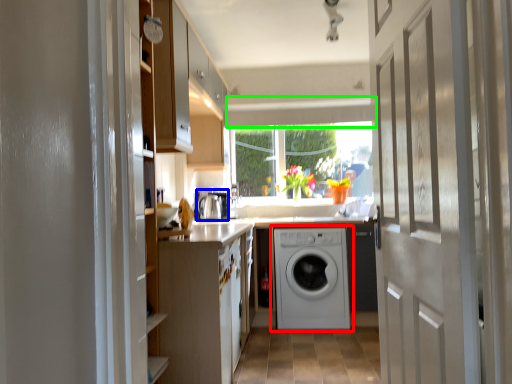
Question: Estimate the real-world distances between objects in this image. Which object is closer to washing machine (highlighted by a red box), appliance (highlighted by a blue box) or exhaust hood (highlighted by a green box)?

Choices:
 (A) appliance
 (B) exhaust hood

Answer: (A)